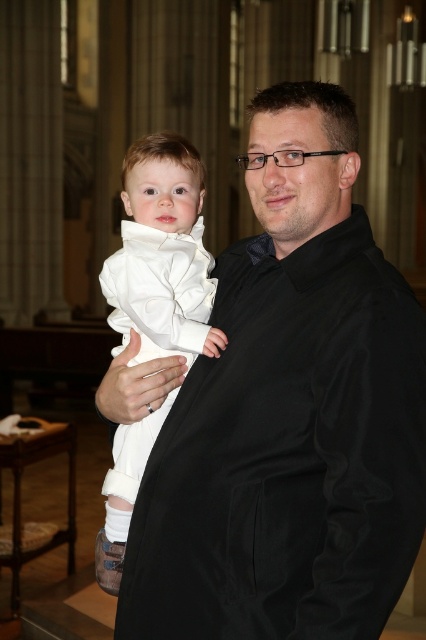
You are a photographer at a special event and need to frame a photo of the black satin coat at center and the white satin baby at center. Given that the camera frame can only accommodate objects with a combined width of 1.2 meters, can both objects fit together if their widths are as described?

The black satin coat at center is wider than the white satin baby at center. However, without knowing the exact widths of each object, we cannot determine if their combined width exceeds 1.2 meters. More information is needed.

You are standing in front of the scene and want to know which of the two points, point (290, 209) or point (147, 435), is closer to you. Can you determine this based on the spatial arrangement?

Point (290, 209) is closer to the viewer than point (147, 435).